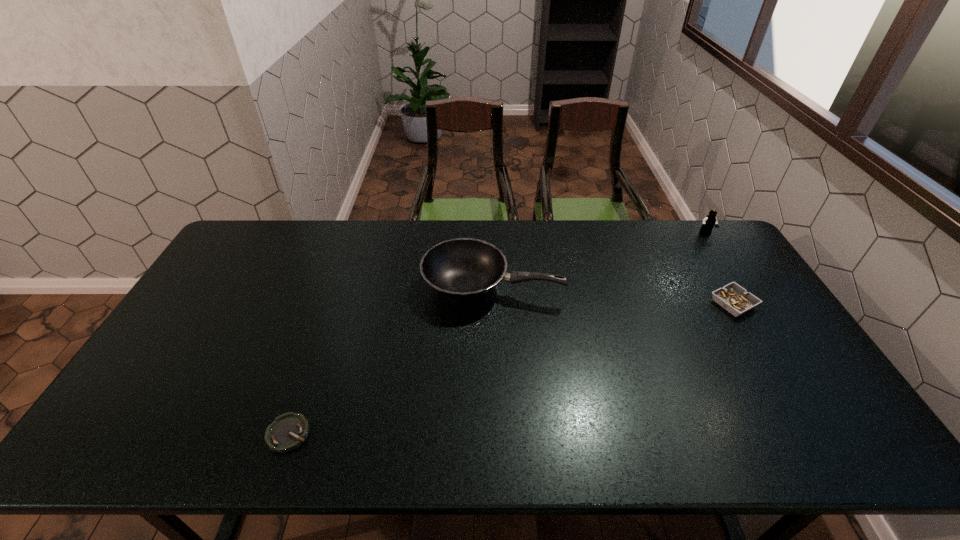
I want to click on free space between the frying pan and the nearest object, so click(x=391, y=360).

Locate an element on the screen. The height and width of the screenshot is (540, 960). object that is the second closest one to the right ashtray is located at coordinates pyautogui.click(x=463, y=269).

Where is `object that stands as the third closest to the shorter ashtray`? This screenshot has height=540, width=960. object that stands as the third closest to the shorter ashtray is located at coordinates (x=709, y=221).

The image size is (960, 540). I want to click on free space that satisfies the following two spatial constraints: 1. on the back side of the left ashtray; 2. on the right side of the farther ashtray, so click(x=333, y=304).